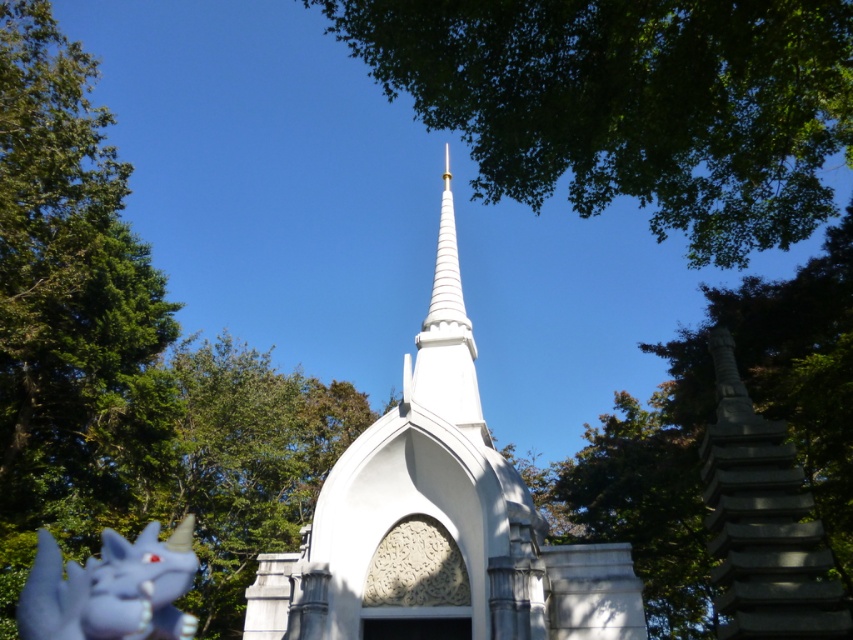
Is green leafy tree at upper center smaller than matte purple dragon at lower left?

Incorrect, green leafy tree at upper center is not smaller in size than matte purple dragon at lower left.

Can you confirm if green leafy tree at upper center is positioned to the right of matte purple dragon at lower left?

Yes, green leafy tree at upper center is to the right of matte purple dragon at lower left.

Where is `green leafy tree at upper center`? green leafy tree at upper center is located at coordinates (630, 104).

Does white stone church at center appear on the left side of matte purple dragon at lower left?

In fact, white stone church at center is to the right of matte purple dragon at lower left.

At what (x,y) coordinates should I click in order to perform the action: click on white stone church at center. Please return your answer as a coordinate pair (x, y). The image size is (853, 640). Looking at the image, I should click on (437, 520).

Can you confirm if white stone church at center is positioned to the right of white glossy spire at center?

No, white stone church at center is not to the right of white glossy spire at center.

Is white stone church at center to the left of white glossy spire at center from the viewer's perspective?

Indeed, white stone church at center is positioned on the left side of white glossy spire at center.

This screenshot has width=853, height=640. I want to click on white stone church at center, so click(437, 520).